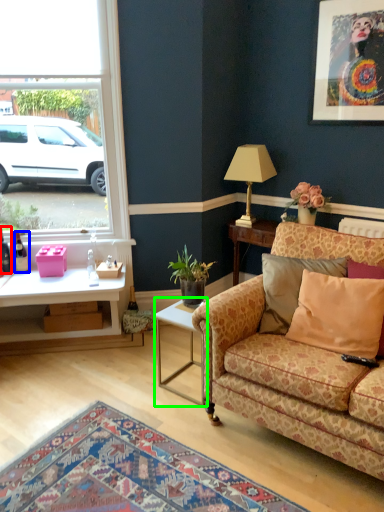
Question: Which object is positioned farthest from bottle (highlighted by a red box)? Select from bottle (highlighted by a blue box) and table (highlighted by a green box).

Choices:
 (A) bottle
 (B) table

Answer: (B)